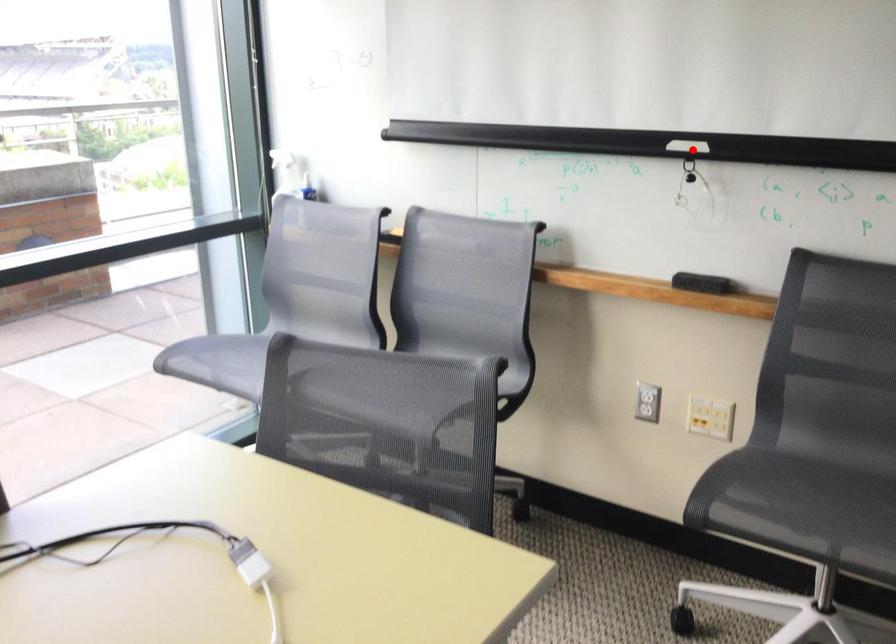
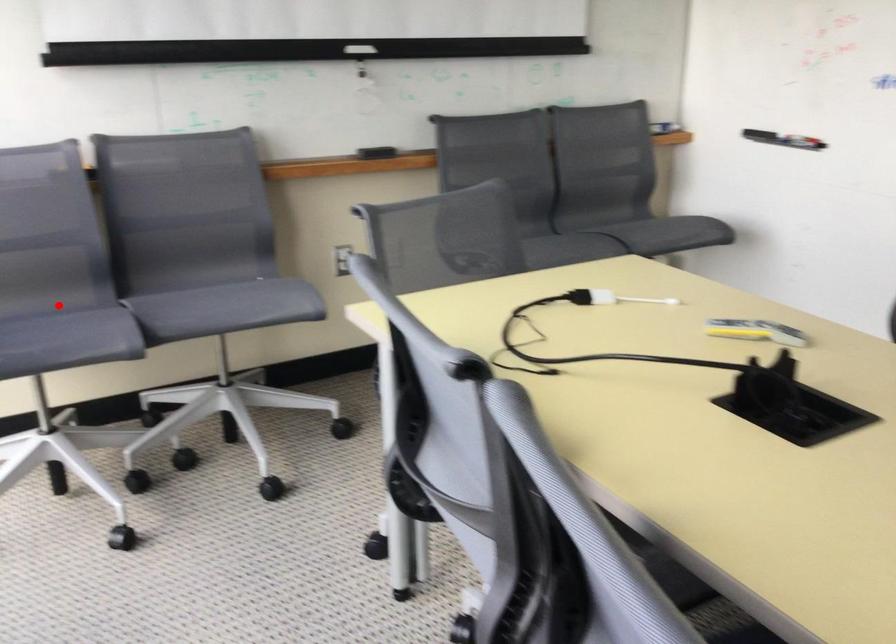
I am providing you with two images of the same scene from different viewpoints. A red point is marked on the first image and another point is marked on the second image. Is the red point in image1 aligned with the point shown in image2?

No